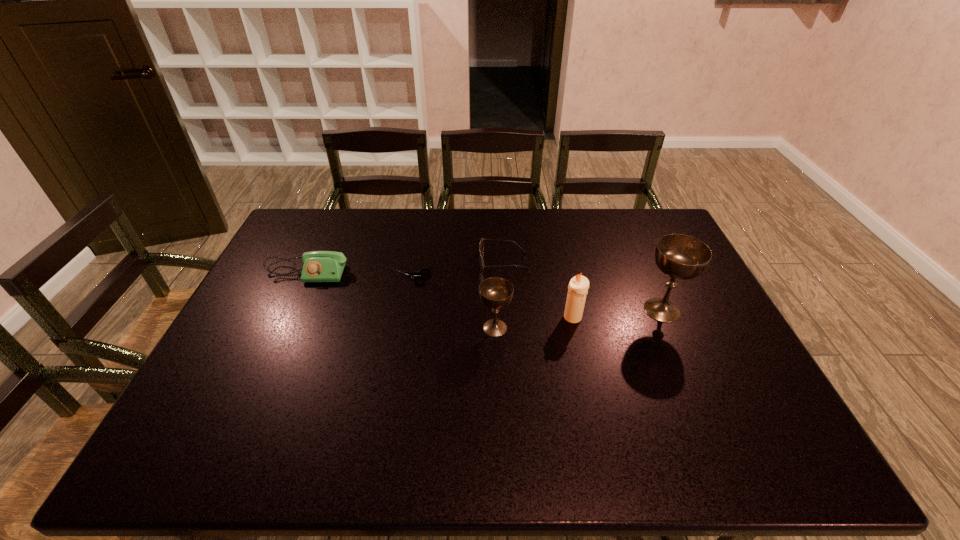
Find the location of a particular element. The width and height of the screenshot is (960, 540). free space in the image that satisfies the following two spatial constraints: 1. on the front-facing side of the sunglasses; 2. on the back side of the rightmost object is located at coordinates (506, 310).

Where is `vacant point that satisfies the following two spatial constraints: 1. on the back side of the candle; 2. on the right side of the taller chalice`? The width and height of the screenshot is (960, 540). vacant point that satisfies the following two spatial constraints: 1. on the back side of the candle; 2. on the right side of the taller chalice is located at coordinates (571, 310).

This screenshot has height=540, width=960. Identify the location of free space that satisfies the following two spatial constraints: 1. on the front-facing side of the sunglasses; 2. on the back side of the tallest object. (506, 310).